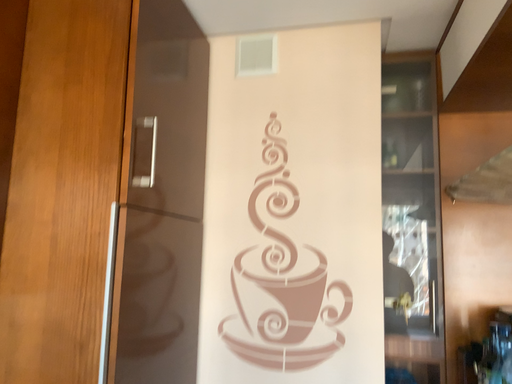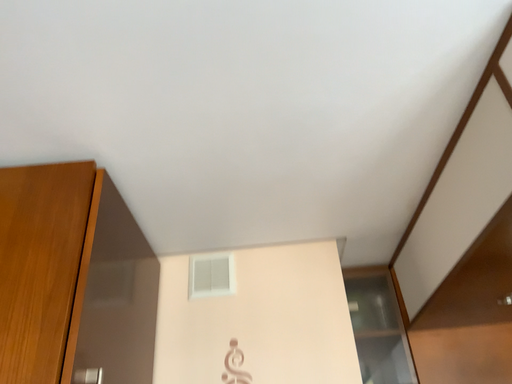
Question: How did the camera likely rotate when shooting the video?

Choices:
 (A) rotated right
 (B) rotated left

Answer: (A)